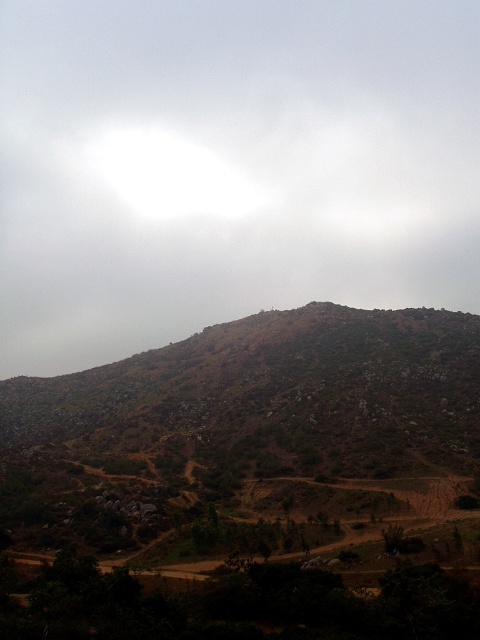
You are a hiker planning to take a photo of the brown rocky mountain at center. You notice there is a white fluffy cloud at upper center in the frame. Based on their sizes, which object would appear wider in the photo?

The white fluffy cloud at upper center would appear wider in the photo since its width surpasses that of the brown rocky mountain at center.

You are a drone operator trying to capture a photo of the mountain landscape. Your drone has a camera with a rectangular field of view that covers the area from coordinates 0.2 to 0.3 on the x and y axes. Will the white fluffy cloud at upper center appear in your photo?

The white fluffy cloud at upper center is located at coordinates (228, 166). The drone camera covers the area from 0.2 to 0.3 on both axes. Since the cloud is at 0.261 on the x and 0.477 on the y, its x coordinate falls within the camera range, but its y coordinate is above 0.3. Therefore, the cloud will not appear in the photo.